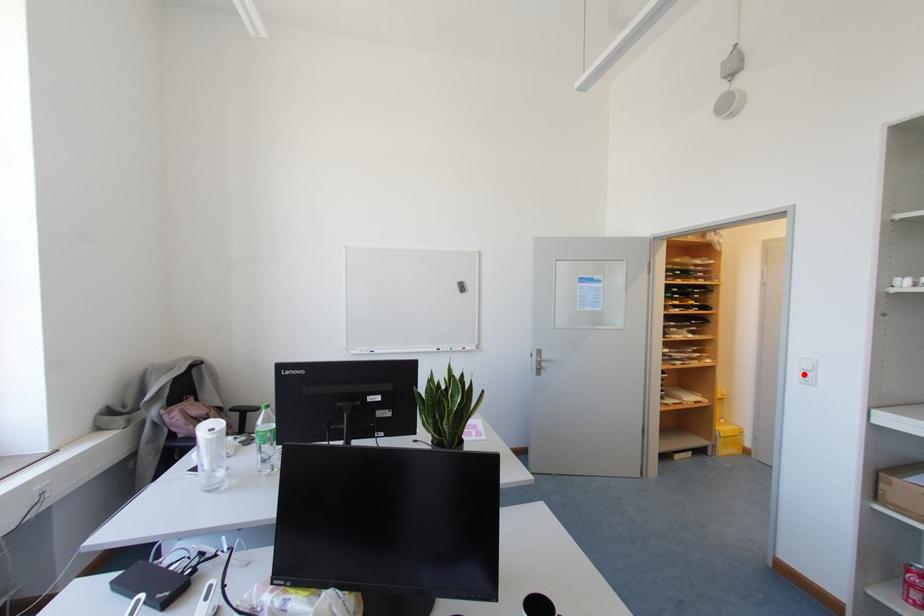
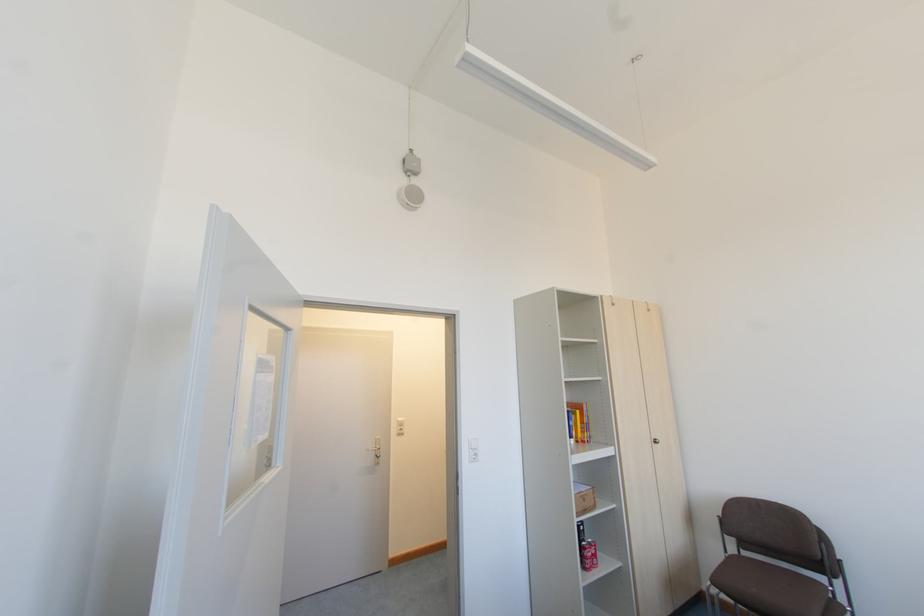
Question: I am providing you with two images of the same scene from different viewpoints. Image1 has a red point marked. In image2, the corresponding 3D location appears at what relative position? Reply with the corresponding letter.

Choices:
 (A) Closer
 (B) Farther

Answer: (B)